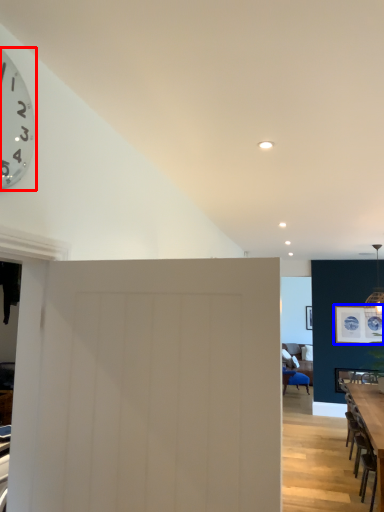
Question: Among these objects, which one is nearest to the camera, wall clock (highlighted by a red box) or picture frame (highlighted by a blue box)?

Choices:
 (A) wall clock
 (B) picture frame

Answer: (A)